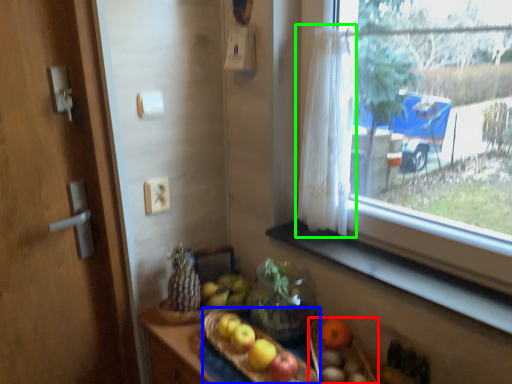
Question: Considering the real-world distances, which object is farthest from basket (highlighted by a red box)? basket (highlighted by a blue box) or curtain (highlighted by a green box)?

Choices:
 (A) basket
 (B) curtain

Answer: (B)